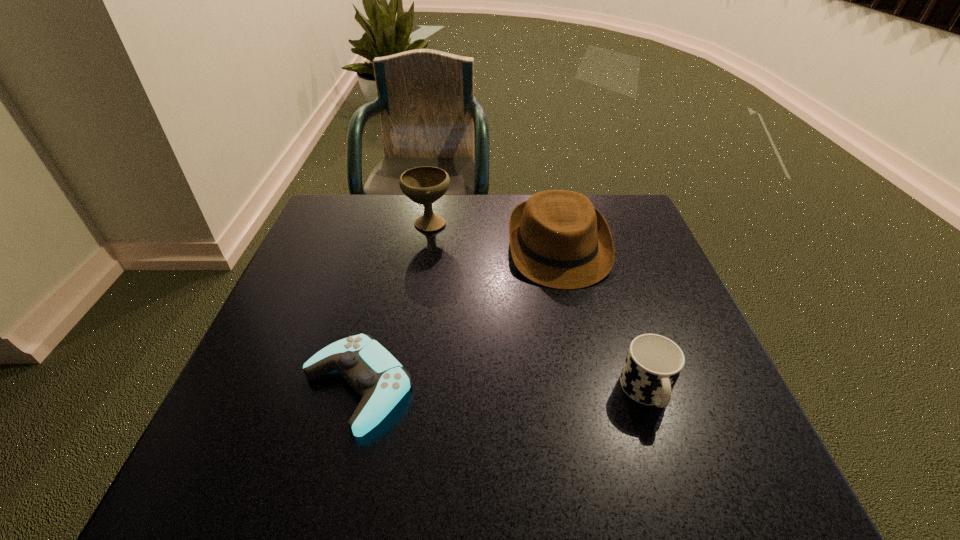
Find the location of a particular element. This screenshot has width=960, height=540. vacant space at the far right corner of the desktop is located at coordinates (633, 213).

Where is `empty space that is in between the third shortest object and the chalice`? The height and width of the screenshot is (540, 960). empty space that is in between the third shortest object and the chalice is located at coordinates (493, 235).

The width and height of the screenshot is (960, 540). I want to click on vacant area between the control and the third shortest object, so click(x=458, y=318).

Identify the location of vacant space that's between the third shortest object and the shortest object. Image resolution: width=960 pixels, height=540 pixels. (458, 318).

The image size is (960, 540). What are the coordinates of `vacant space that is in between the fedora and the chalice` in the screenshot? It's located at (493, 235).

Where is `vacant area that lies between the third shortest object and the shortest object`? vacant area that lies between the third shortest object and the shortest object is located at coordinates (458, 318).

Find the location of a particular element. The height and width of the screenshot is (540, 960). vacant space that is in between the third tallest object and the fedora is located at coordinates (603, 320).

The width and height of the screenshot is (960, 540). Find the location of `unoccupied area between the tallest object and the third shortest object`. unoccupied area between the tallest object and the third shortest object is located at coordinates pyautogui.click(x=493, y=235).

The height and width of the screenshot is (540, 960). I want to click on vacant region between the second shortest object and the chalice, so click(x=538, y=307).

Where is `free space between the cup and the shortest object`? The height and width of the screenshot is (540, 960). free space between the cup and the shortest object is located at coordinates (502, 389).